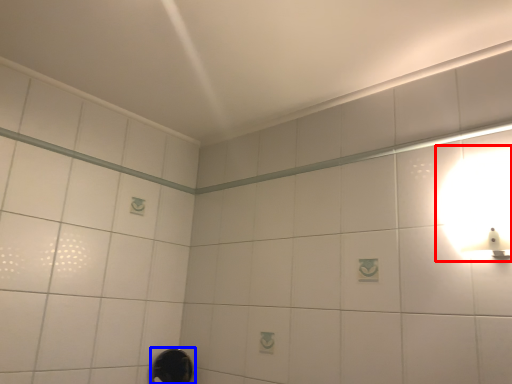
Question: Among these objects, which one is nearest to the camera, light fixture (highlighted by a red box) or shower (highlighted by a blue box)?

Choices:
 (A) light fixture
 (B) shower

Answer: (A)